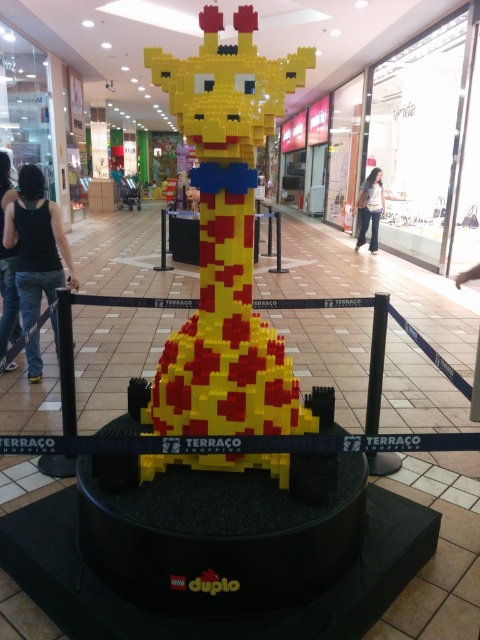
You are standing at the entrance of the mall and see the LEGO giraffe sculpture. There are two points marked on the ground in front of the sculpture. One is at point coordinates point [262,465] and the other is at point coordinates point [20,196]. If you want to take a photo of the giraffe from the closest possible position without crossing the barrier tape, which point should you stand at?

You should stand at point [20,196] because it is closer to the giraffe sculpture than point [262,465], and since the barrier tape surrounds the base, this point is within the accessible area.

You are a parent holding a 1.2 meter tall child. You want to let the child touch the yellow lego giraffe at center. Can the child reach it without standing on something?

The yellow lego giraffe at center is 1.52 meters away from the viewer. Since the child is 1.2 meters tall, they cannot reach it without standing on something because the distance is greater than their height.

You are standing in the mall and want to take a photo of the yellow lego giraffe at center. If your camera can focus on objects up to 5 feet away, will you need to move closer or farther away to get a clear picture?

The yellow lego giraffe at center is 4.97 feet away from you, which is within the camera focus range of up to 5 feet. Therefore, you do not need to move closer or farther away to get a clear picture.